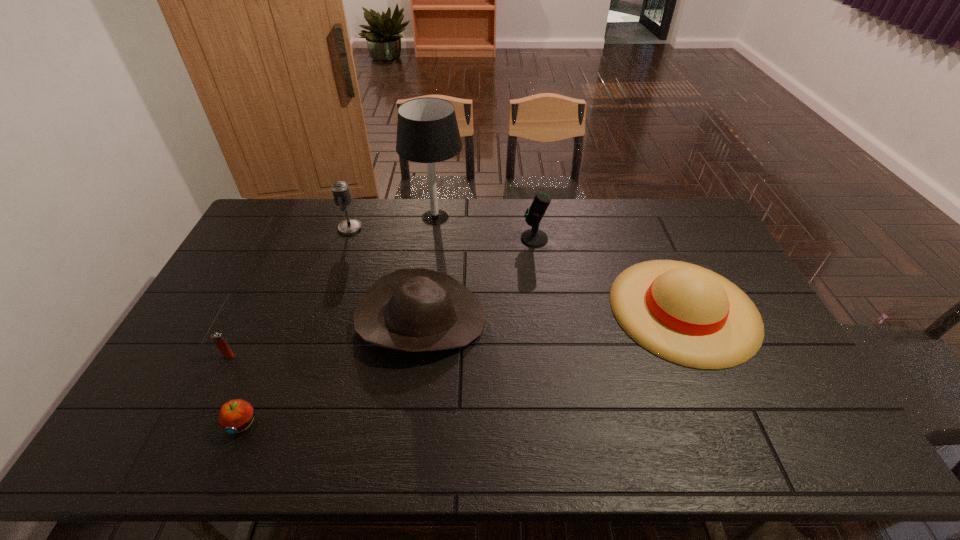
At what (x,y) coordinates should I click in order to perform the action: click on empty space between the rightmost object and the second object from right to left. Please return your answer as a coordinate pair (x, y). Looking at the image, I should click on coord(609,274).

Image resolution: width=960 pixels, height=540 pixels. What are the coordinates of `free spot between the right microphone and the cowboy hat` in the screenshot? It's located at (477, 279).

Select which object appears as the closest to the right microphone. Please provide its 2D coordinates. Your answer should be formatted as a tuple, i.e. [(x, y)], where the tuple contains the x and y coordinates of a point satisfying the conditions above.

[(686, 314)]

Locate which object ranks in proximity to the left microphone. Please provide its 2D coordinates. Your answer should be formatted as a tuple, i.e. [(x, y)], where the tuple contains the x and y coordinates of a point satisfying the conditions above.

[(427, 131)]